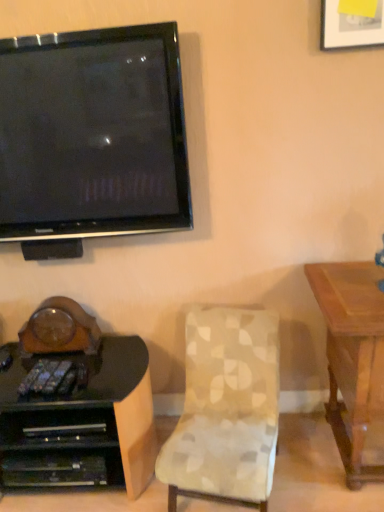
Question: Is patterned fabric chair at center surrounding black glossy television at upper left?

Choices:
 (A) yes
 (B) no

Answer: (B)

Question: Is patterned fabric chair at center facing towards black glossy television at upper left?

Choices:
 (A) yes
 (B) no

Answer: (B)

Question: Considering the relative sizes of patterned fabric chair at center and black glossy television at upper left in the image provided, is patterned fabric chair at center taller than black glossy television at upper left?

Choices:
 (A) no
 (B) yes

Answer: (A)

Question: Is black glossy television at upper left at the back of patterned fabric chair at center?

Choices:
 (A) no
 (B) yes

Answer: (A)

Question: From the image's perspective, is patterned fabric chair at center on black glossy television at upper left?

Choices:
 (A) no
 (B) yes

Answer: (A)

Question: Visually, is black glossy television at upper left positioned to the left or to the right of patterned fabric chair at center?

Choices:
 (A) left
 (B) right

Answer: (A)

Question: From the image's perspective, relative to patterned fabric chair at center, is black glossy television at upper left above or below?

Choices:
 (A) above
 (B) below

Answer: (A)

Question: In terms of width, does black glossy television at upper left look wider or thinner when compared to patterned fabric chair at center?

Choices:
 (A) wide
 (B) thin

Answer: (B)

Question: Is black glossy television at upper left spatially inside patterned fabric chair at center, or outside of it?

Choices:
 (A) inside
 (B) outside

Answer: (B)

Question: Relative to patterned fabric chair at center, is black glossy desk at lower left in front or behind?

Choices:
 (A) front
 (B) behind

Answer: (B)

Question: Do you think black glossy desk at lower left is within patterned fabric chair at center, or outside of it?

Choices:
 (A) inside
 (B) outside

Answer: (B)

Question: In the image, is black glossy desk at lower left on the left side or the right side of patterned fabric chair at center?

Choices:
 (A) left
 (B) right

Answer: (A)

Question: From the image's perspective, is black glossy desk at lower left positioned above or below patterned fabric chair at center?

Choices:
 (A) below
 (B) above

Answer: (A)

Question: Would you say black glossy desk at lower left is to the left or to the right of black glossy television at upper left in the picture?

Choices:
 (A) left
 (B) right

Answer: (A)

Question: Choose the correct answer: Is black glossy desk at lower left inside black glossy television at upper left or outside it?

Choices:
 (A) inside
 (B) outside

Answer: (B)